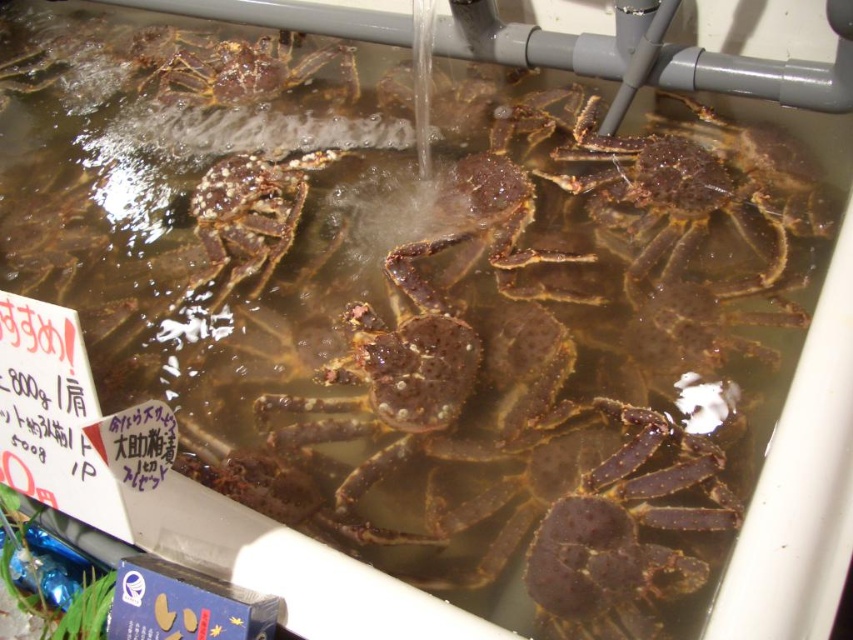
You are a customer at a seafood market and want to point out the speckled brown crab at center to the vendor. Where exactly is it located in the tank?

The speckled brown crab at center is located at point [248,216] in the tank.